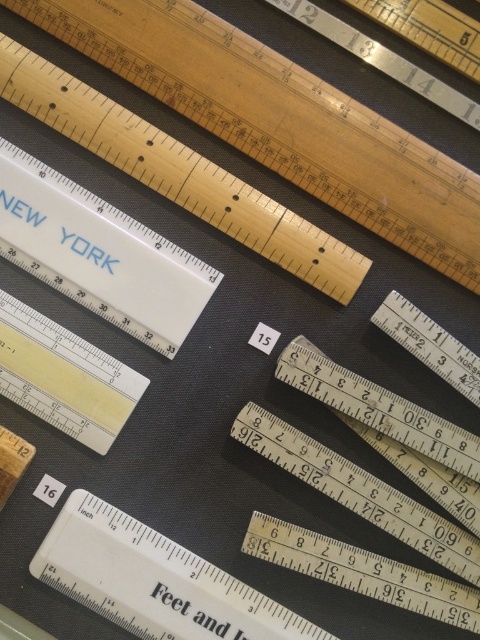
In the image of rulers, where is the white plastic ruler at upper left located?

The white plastic ruler at upper left is located at point (98, 253).